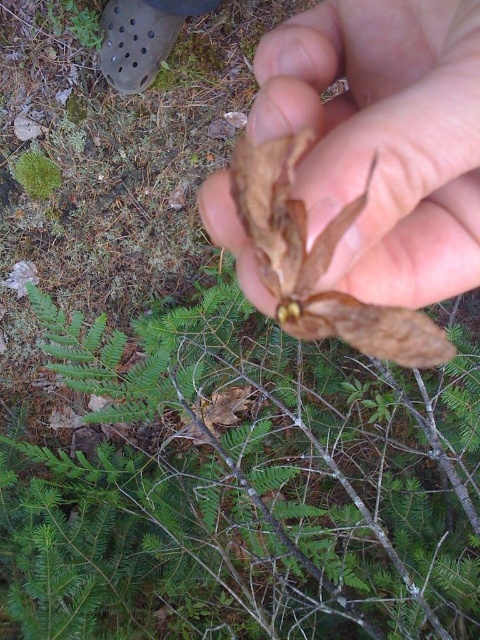
Who is shorter, brown matte leaf at upper center or green fuzzy moss at upper left?

green fuzzy moss at upper left is shorter.

Is point (227, 189) positioned behind point (39, 176)?

No.

At what (x,y) coordinates should I click in order to perform the action: click on brown matte leaf at upper center. Please return your answer as a coordinate pair (x, y). The width and height of the screenshot is (480, 640). Looking at the image, I should click on (384, 138).